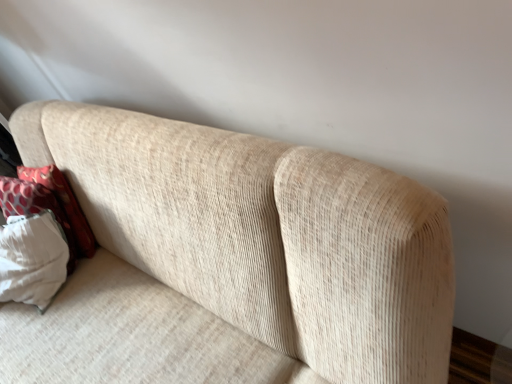
Question: From the image's perspective, is beige corduroy couch at upper center over white textured pillow at left?

Choices:
 (A) no
 (B) yes

Answer: (A)

Question: Can you confirm if beige corduroy couch at upper center is smaller than white textured pillow at left?

Choices:
 (A) yes
 (B) no

Answer: (B)

Question: From the image's perspective, does beige corduroy couch at upper center appear lower than white textured pillow at left?

Choices:
 (A) no
 (B) yes

Answer: (B)

Question: Is the position of beige corduroy couch at upper center less distant than that of white textured pillow at left?

Choices:
 (A) yes
 (B) no

Answer: (A)

Question: Is beige corduroy couch at upper center oriented away from white textured pillow at left?

Choices:
 (A) yes
 (B) no

Answer: (A)

Question: Is beige corduroy couch at upper center taller than white textured pillow at left?

Choices:
 (A) yes
 (B) no

Answer: (A)

Question: Is white textured pillow at left shorter than beige corduroy couch at upper center?

Choices:
 (A) yes
 (B) no

Answer: (A)

Question: Is white textured pillow at left smaller than beige corduroy couch at upper center?

Choices:
 (A) yes
 (B) no

Answer: (A)

Question: Does white textured pillow at left appear on the left side of beige corduroy couch at upper center?

Choices:
 (A) no
 (B) yes

Answer: (B)

Question: Does white textured pillow at left have a larger size compared to beige corduroy couch at upper center?

Choices:
 (A) no
 (B) yes

Answer: (A)

Question: From the image's perspective, would you say white textured pillow at left is positioned over beige corduroy couch at upper center?

Choices:
 (A) yes
 (B) no

Answer: (A)

Question: From a real-world perspective, is white textured pillow at left on top of beige corduroy couch at upper center?

Choices:
 (A) no
 (B) yes

Answer: (B)

Question: From the image's perspective, is white textured pillow at left positioned above or below beige corduroy couch at upper center?

Choices:
 (A) above
 (B) below

Answer: (A)